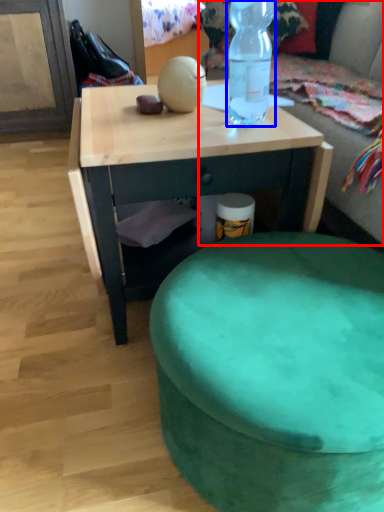
Question: Which object is further to the camera taking this photo, bean bag chair (highlighted by a red box) or bottle (highlighted by a blue box)?

Choices:
 (A) bean bag chair
 (B) bottle

Answer: (A)